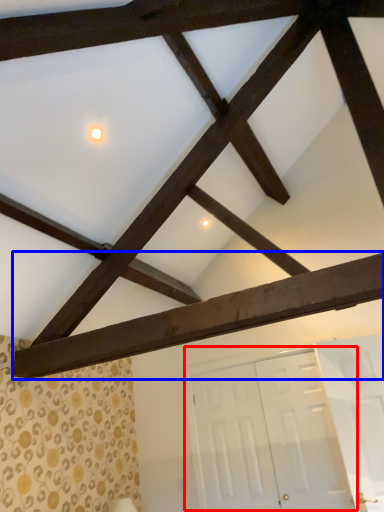
Question: Which of the following is the farthest to the observer, door (highlighted by a red box) or plank (highlighted by a blue box)?

Choices:
 (A) door
 (B) plank

Answer: (A)